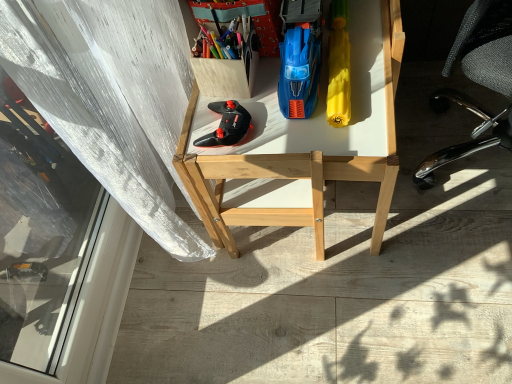
What do you see at coordinates (485, 46) in the screenshot? I see `black mesh office chair at right` at bounding box center [485, 46].

Where is `black mesh office chair at right`? black mesh office chair at right is located at coordinates point(485,46).

Describe the element at coordinates (339, 67) in the screenshot. Image resolution: width=512 pixels, height=384 pixels. I see `yellow matte umbrella at right, the fourth stationery from the left` at that location.

The image size is (512, 384). What do you see at coordinates (226, 74) in the screenshot?
I see `wooden box at upper left, which appears as the third stationery when viewed from the right` at bounding box center [226, 74].

Image resolution: width=512 pixels, height=384 pixels. What are the coordinates of `wooden box at upper left, which appears as the third stationery when viewed from the right` in the screenshot? It's located at (226, 74).

Find the location of a particular element. The width and height of the screenshot is (512, 384). black mesh office chair at right is located at coordinates (485, 46).

How many degrees apart are the facing directions of black mesh office chair at right and wooden box at upper left, which appears as the third stationery when viewed from the right?

The facing directions of black mesh office chair at right and wooden box at upper left, which appears as the third stationery when viewed from the right, are 36 degrees apart.

Where is `chair in front of the wooden box at upper left, which appears as the third stationery when viewed from the right`? This screenshot has height=384, width=512. chair in front of the wooden box at upper left, which appears as the third stationery when viewed from the right is located at coordinates (485, 46).

Would you say black mesh office chair at right is a long distance from wooden box at upper left, placed as the second stationery when sorted from left to right?

No, black mesh office chair at right is not far from wooden box at upper left, placed as the second stationery when sorted from left to right.

Is point (501, 19) positioned behind point (230, 78)?

That is False.

At what (x,y) coordinates should I click in order to perform the action: click on desk on the right of blue plastic toy car at center, the third stationery when ordered from left to right. Please return your answer as a coordinate pair (x, y). This screenshot has width=512, height=384. Looking at the image, I should click on (302, 143).

Which object is positioned more to the left, blue plastic toy car at center, the 2th stationery from the right, or wooden desk at center?

blue plastic toy car at center, the 2th stationery from the right.

Is blue plastic toy car at center, the third stationery when ordered from left to right, closer to camera compared to wooden desk at center?

Yes.

From a real-world perspective, relative to wooden desk at center, is blue plastic toy car at center, the 2th stationery from the right, vertically above or below?

blue plastic toy car at center, the 2th stationery from the right, is above wooden desk at center.

Can you confirm if blue plastic toy car at center, the 2th stationery from the right, is bigger than wooden box at upper left, placed as the second stationery when sorted from left to right?

Yes.

From a real-world perspective, is blue plastic toy car at center, the 2th stationery from the right, below wooden box at upper left, placed as the second stationery when sorted from left to right?

Incorrect, from a real-world perspective, blue plastic toy car at center, the 2th stationery from the right, is higher than wooden box at upper left, placed as the second stationery when sorted from left to right.

Is blue plastic toy car at center, the third stationery when ordered from left to right, aimed at wooden box at upper left, which appears as the third stationery when viewed from the right?

No, blue plastic toy car at center, the third stationery when ordered from left to right, is not aimed at wooden box at upper left, which appears as the third stationery when viewed from the right.

Considering the relative sizes of blue plastic toy car at center, the 2th stationery from the right, and wooden box at upper left, which appears as the third stationery when viewed from the right, in the image provided, is blue plastic toy car at center, the 2th stationery from the right, shorter than wooden box at upper left, which appears as the third stationery when viewed from the right,?

No.

How different are the orientations of black mesh office chair at right and wooden desk at center in degrees?

54.9 degrees.

Does black mesh office chair at right turn towards wooden desk at center?

No, black mesh office chair at right is not turned towards wooden desk at center.

Looking at this image, between black mesh office chair at right and wooden desk at center, which one has more height?

With more height is black mesh office chair at right.

Find the location of a particular element. desk behind the black mesh office chair at right is located at coordinates (302, 143).

In the scene shown: Does black mesh office chair at right have a lesser height compared to matte plastic container at upper center, marked as the fourth stationery in a right-to-left arrangement?

Incorrect, the height of black mesh office chair at right does not fall short of that of matte plastic container at upper center, marked as the fourth stationery in a right-to-left arrangement.

Based on the photo, does black mesh office chair at right have a smaller size compared to matte plastic container at upper center, marked as the fourth stationery in a right-to-left arrangement?

Incorrect, black mesh office chair at right is not smaller in size than matte plastic container at upper center, marked as the fourth stationery in a right-to-left arrangement.

Based on the photo, can you confirm if black mesh office chair at right is positioned to the left of matte plastic container at upper center, positioned as the first stationery in left-to-right order?

Incorrect, black mesh office chair at right is not on the left side of matte plastic container at upper center, positioned as the first stationery in left-to-right order.

Would you consider black mesh office chair at right to be distant from matte plastic container at upper center, marked as the fourth stationery in a right-to-left arrangement?

Actually, black mesh office chair at right and matte plastic container at upper center, marked as the fourth stationery in a right-to-left arrangement, are a little close together.

From a real-world perspective, relative to yellow matte umbrella at right, the 1th stationery from the right, is wooden desk at center vertically above or below?

wooden desk at center is situated lower than yellow matte umbrella at right, the 1th stationery from the right, in the real world.

Is wooden desk at center positioned with its back to yellow matte umbrella at right, the fourth stationery from the left?

No, wooden desk at center is not facing the opposite direction of yellow matte umbrella at right, the fourth stationery from the left.

Does wooden desk at center touch yellow matte umbrella at right, the 1th stationery from the right?

No, wooden desk at center is not in contact with yellow matte umbrella at right, the 1th stationery from the right.

Is yellow matte umbrella at right, the 1th stationery from the right, wider than wooden desk at center?

No, yellow matte umbrella at right, the 1th stationery from the right, is not wider than wooden desk at center.

From the image's perspective, is yellow matte umbrella at right, the fourth stationery from the left, located above wooden desk at center?

Yes, from the image's perspective, yellow matte umbrella at right, the fourth stationery from the left, is above wooden desk at center.

Is wooden desk at center at the back of yellow matte umbrella at right, the fourth stationery from the left?

Yes, yellow matte umbrella at right, the fourth stationery from the left, is positioned with its back facing wooden desk at center.

In order to click on the 2nd stationery behind the wooden desk at center, counting from the anchor's position in this screenshot , I will do `click(339, 67)`.

The image size is (512, 384). What are the coordinates of `chair on the right of wooden box at upper left, which appears as the third stationery when viewed from the right` in the screenshot? It's located at (485, 46).

At what (x,y) coordinates should I click in order to perform the action: click on desk behind the blue plastic toy car at center, the 2th stationery from the right. Please return your answer as a coordinate pair (x, y). The image size is (512, 384). Looking at the image, I should click on (302, 143).

Looking at the image, which one is located further to wooden box at upper left, which appears as the third stationery when viewed from the right, wooden desk at center or black mesh office chair at right?

Among the two, black mesh office chair at right is located further to wooden box at upper left, which appears as the third stationery when viewed from the right.

From the image, which object appears to be farther from yellow matte umbrella at right, the fourth stationery from the left, wooden desk at center or black matte controller at center?

black matte controller at center.

Based on their spatial positions, is wooden desk at center or matte plastic container at upper center, marked as the fourth stationery in a right-to-left arrangement, closer to wooden box at upper left, placed as the second stationery when sorted from left to right?

matte plastic container at upper center, marked as the fourth stationery in a right-to-left arrangement, lies closer to wooden box at upper left, placed as the second stationery when sorted from left to right, than the other object.

Considering their positions, is black mesh office chair at right positioned further to wooden desk at center than matte plastic container at upper center, positioned as the first stationery in left-to-right order?

black mesh office chair at right.

When comparing their distances from yellow matte umbrella at right, the fourth stationery from the left, does wooden box at upper left, placed as the second stationery when sorted from left to right, or wooden desk at center seem further?

The object further to yellow matte umbrella at right, the fourth stationery from the left, is wooden box at upper left, placed as the second stationery when sorted from left to right.

Which object lies nearer to the anchor point yellow matte umbrella at right, the fourth stationery from the left, matte plastic container at upper center, marked as the fourth stationery in a right-to-left arrangement, or wooden box at upper left, which appears as the third stationery when viewed from the right?

Among the two, wooden box at upper left, which appears as the third stationery when viewed from the right, is located nearer to yellow matte umbrella at right, the fourth stationery from the left.

Which object lies further to the anchor point wooden desk at center, yellow matte umbrella at right, the 1th stationery from the right, or matte plastic container at upper center, marked as the fourth stationery in a right-to-left arrangement?

The object further to wooden desk at center is matte plastic container at upper center, marked as the fourth stationery in a right-to-left arrangement.

Estimate the real-world distances between objects in this image. Which object is further from matte plastic container at upper center, positioned as the first stationery in left-to-right order, black matte controller at center or wooden desk at center?

The object further to matte plastic container at upper center, positioned as the first stationery in left-to-right order, is wooden desk at center.

Identify the location of stationery situated between blue plastic toy car at center, the third stationery when ordered from left to right, and black mesh office chair at right from left to right. The width and height of the screenshot is (512, 384). (339, 67).

The height and width of the screenshot is (384, 512). I want to click on desk between matte plastic container at upper center, positioned as the first stationery in left-to-right order, and yellow matte umbrella at right, the 1th stationery from the right, so click(x=302, y=143).

Locate an element on the screen. The height and width of the screenshot is (384, 512). stationery between matte plastic container at upper center, marked as the fourth stationery in a right-to-left arrangement, and black matte controller at center, in the vertical direction is located at coordinates (226, 74).

Find the location of a particular element. desk between wooden box at upper left, placed as the second stationery when sorted from left to right, and black mesh office chair at right is located at coordinates (302, 143).